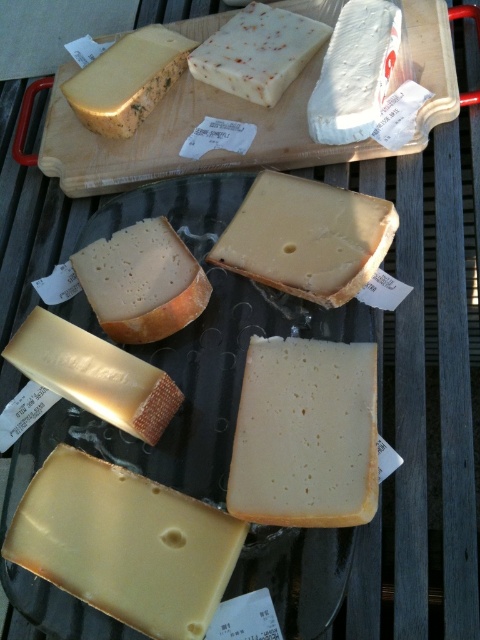
What type of cheese is located at the coordinates point (355, 72)?

The cheese at point (355, 72) is white crumbly cheese at upper center.

You are standing in front of a display of cheeses on a wooden cutting board and a glass plate. You see a point labeled as point (x=108, y=529). If you want to reach this point with a 100 cm long spoon, will the spoon be long enough?

The distance between point (x=108, y=529) and the camera is 87.28 centimeters. Since the spoon is 100 cm long, it is longer than the required distance, so the spoon will be long enough to reach the point.